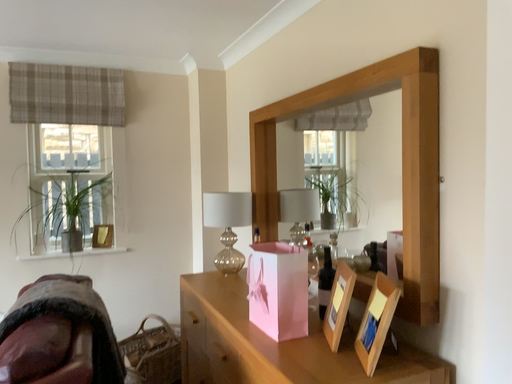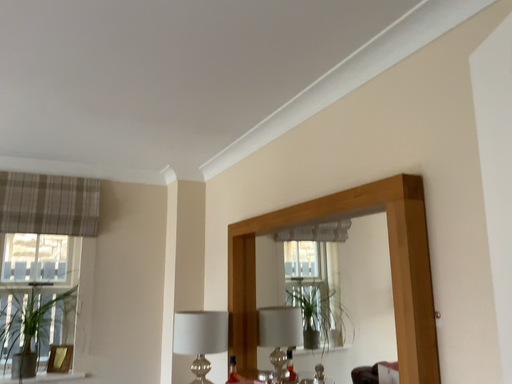
Question: How did the camera likely rotate when shooting the video?

Choices:
 (A) rotated downward
 (B) rotated upward

Answer: (B)